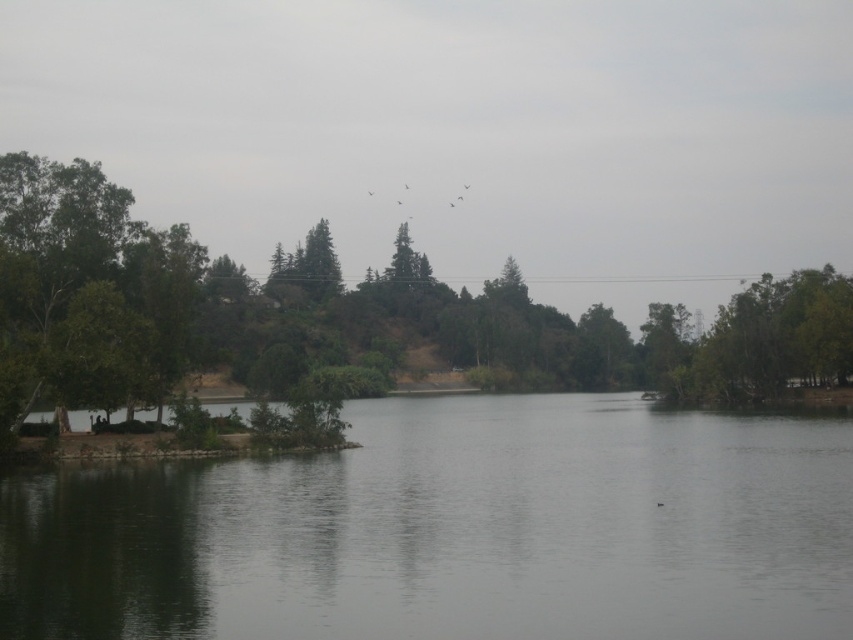
Question: Does smooth gray water at center have a lesser width compared to green leafy tree at left?

Choices:
 (A) no
 (B) yes

Answer: (B)

Question: Can you confirm if smooth gray water at center is thinner than green leafy tree at left?

Choices:
 (A) no
 (B) yes

Answer: (B)

Question: Which of the following is the farthest from the observer?

Choices:
 (A) (596, 305)
 (B) (801, 477)

Answer: (A)

Question: From the image, what is the correct spatial relationship of smooth gray water at center in relation to green leafy tree at left?

Choices:
 (A) right
 (B) left

Answer: (B)

Question: Which point is closer to the camera taking this photo?

Choices:
 (A) (404, 580)
 (B) (173, 234)

Answer: (A)